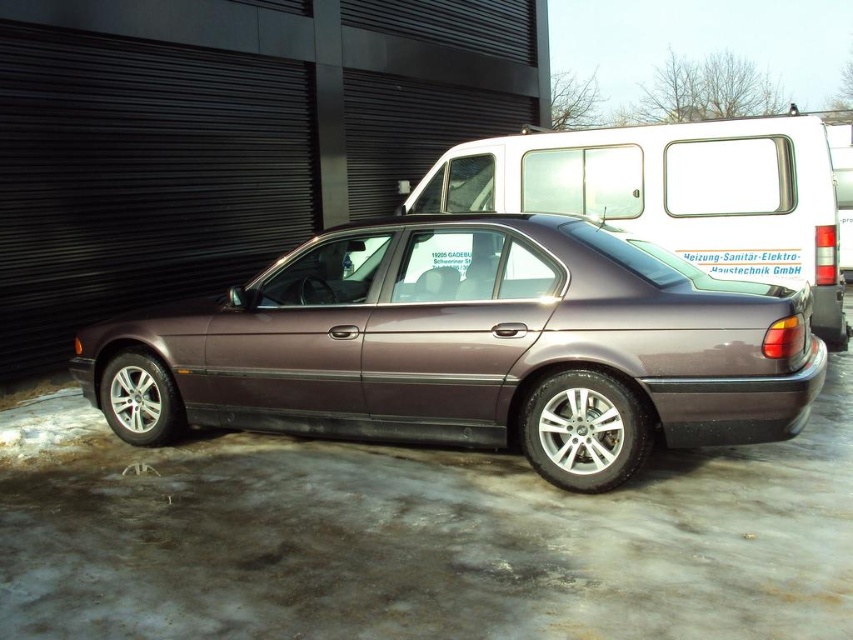
You are standing next to a camera that is 5 feet tall. You want to take a photo of the satin metallic car at center without bending down or leaning back. Can you do it?

The satin metallic car at center and camera are 8.83 feet apart. Since the camera is 5 feet tall and the car is positioned 8.83 feet away, you can take the photo without bending down or leaning back as the distance allows for a clear view.

You are a delivery driver who needs to back out of a parking spot between the satin metallic car at center and the metallic silver van at center. Which direction should you turn your steering wheel to exit the parking space?

Since the satin metallic car at center is to the left of the metallic silver van at center, you should turn your steering wheel to the right to exit the parking space between them.

You are standing in front of the maroon sedan and want to determine the distance between two points marked on the car. The points are labeled as point 1 at coordinates (169, 340) and point 2 at (584, 186). Since you don not have a measuring tool, you recall that point 1 is closer to you than point 2. Based on this information, which point is located higher up on the car?

Point 2 at (584, 186) is located higher up on the car because even though point 1 is closer to the viewer, the y coordinate of point 2 is higher, indicating it is positioned higher vertically on the car.